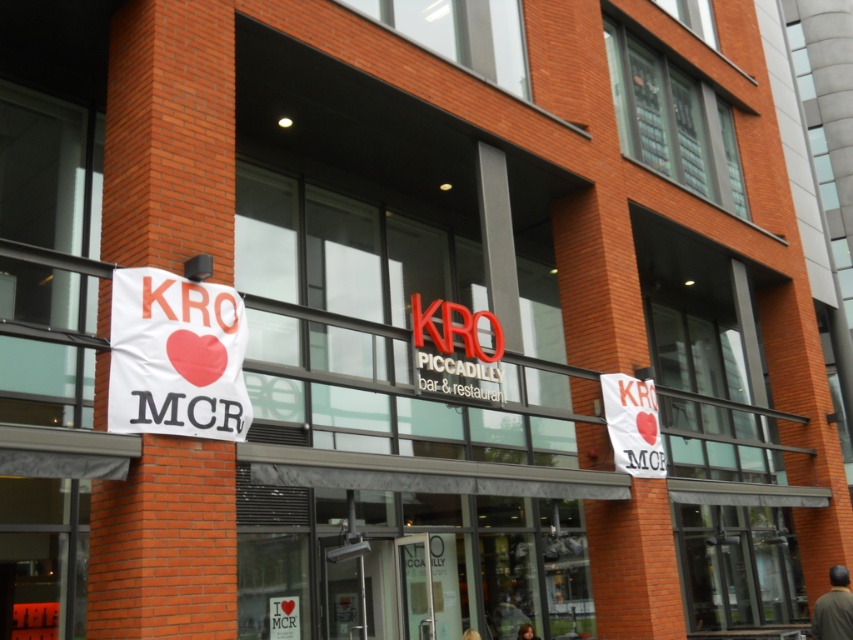
Question: Can you confirm if white paper banner at center is smaller than white paper at center?

Choices:
 (A) no
 (B) yes

Answer: (A)

Question: Is white paper banner at left positioned at the back of white paper banner at center?

Choices:
 (A) no
 (B) yes

Answer: (A)

Question: Which point is farther to the camera?

Choices:
 (A) (165, 401)
 (B) (619, 384)
 (C) (299, 621)

Answer: (B)

Question: Considering the real-world distances, which object is closest to the white paper banner at center?

Choices:
 (A) white paper banner at left
 (B) white paper at center

Answer: (B)

Question: From the image, what is the correct spatial relationship of white paper banner at left in relation to white paper banner at center?

Choices:
 (A) right
 (B) left

Answer: (B)

Question: Which is nearer to the white paper banner at center?

Choices:
 (A) white paper at center
 (B) white paper banner at left

Answer: (A)